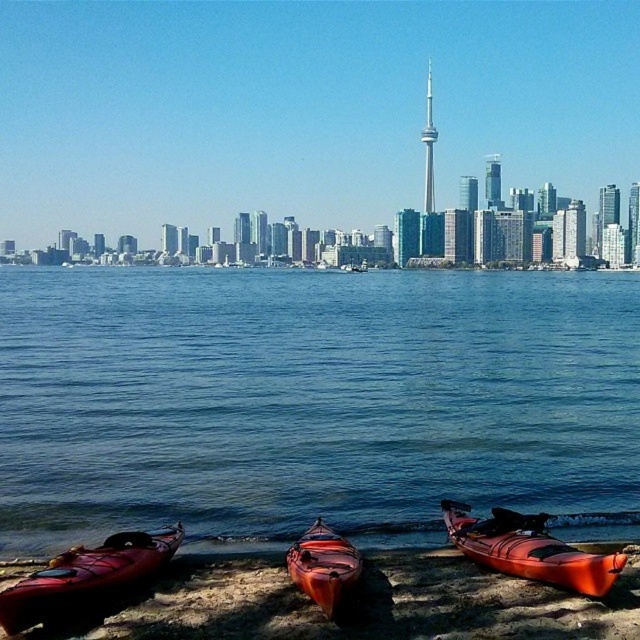
You are standing at the origin point of the coordinate system in the image, which is the bottom left corner. You want to locate the orange matte kayak at lower right. Can you tell me its coordinates?

The orange matte kayak at lower right is located at coordinates point (529,548).

You are standing on the sandy shore and want to reach the blue water at lower center. There is a matte orange canoe at lower left in your way. Which direction should you move to avoid the canoe?

Since the blue water at lower center is further to the viewer than the matte orange canoe at lower left, you should move towards the right to go around the canoe and reach the blue water at lower center.

You are standing on the sandy shore and want to reach the blue water at lower center. Which direction should you move relative to the matte orange canoe at lower left?

To reach the blue water at lower center, you should move to the right of the matte orange canoe at lower left since the blue water at lower center is positioned to the right of it.